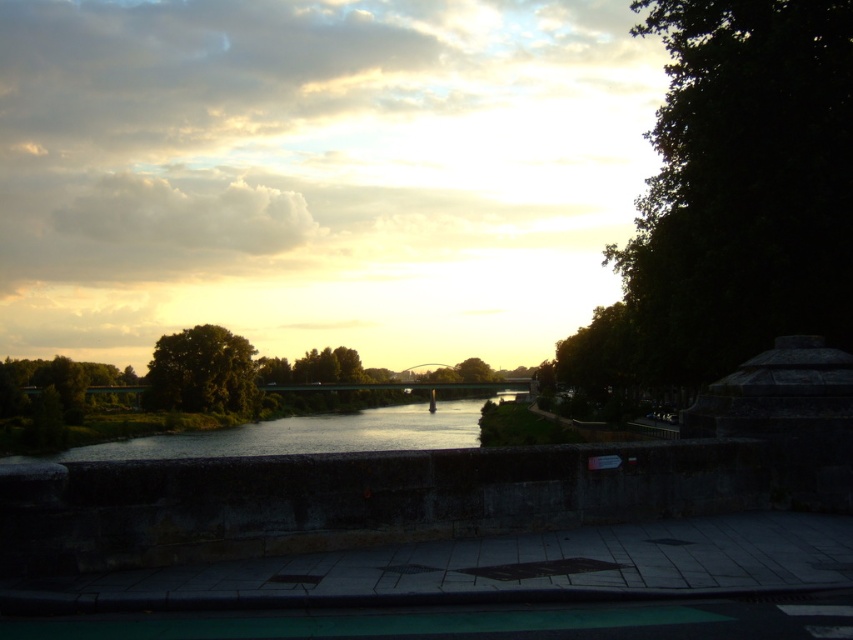
You are standing on the walkway and want to know which tree has a larger width between the dark green leafy tree at right and the green leafy tree at center. Which one is wider?

The dark green leafy tree at right might be wider than green leafy tree at center.

You are standing on the walkway and want to take a photo of the silvery reflective water at center and the dark green leafy tree at right. Which object should you position closer to the left side of your camera frame?

The silvery reflective water at center should be positioned closer to the left side of your camera frame because the dark green leafy tree at right is to the right of it.